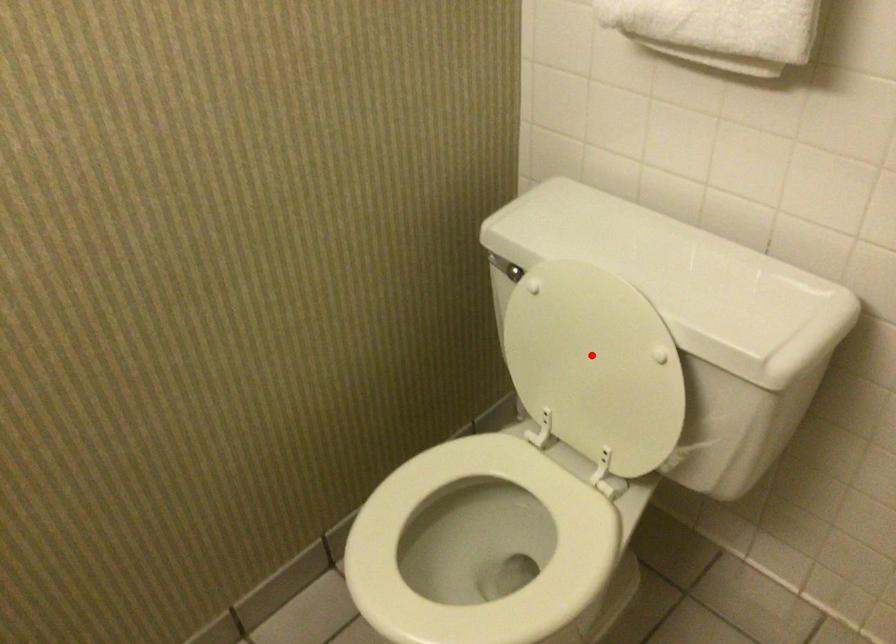
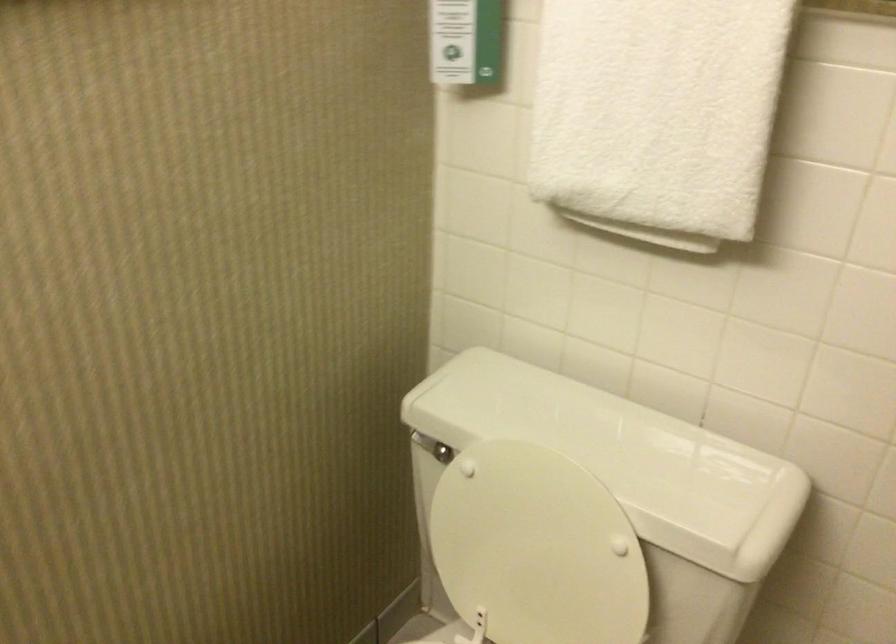
In the second image, find the point that corresponds to the highlighted location in the first image.

(536, 547)